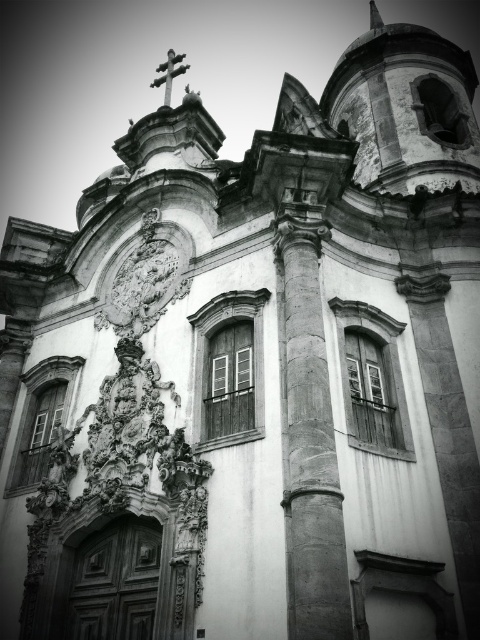
You are an architect analyzing the building facade. Which object, the smooth stone column at center or the metallic cross at upper center, is positioned closer to the observer?

The smooth stone column at center is closer to the viewer than the metallic cross at upper center.

You are an architect planning to install a new light fixture between the smooth stone column at center and the matte white clock at center. The light fixture requires a minimum of 3 meters of space between the two objects to be safely installed. Based on the scene description, is there enough space for the installation?

The smooth stone column at center and matte white clock at center are 25.62 meters apart, which is more than the required 3 meters. Therefore, there is sufficient space to install the light fixture between them.

You are standing in front of a historic Baroque building and notice a point marked at coordinates (310, 436). Based on the scene description, which architectural feature does this point most likely correspond to?

The point at coordinates (310, 436) corresponds to the smooth stone column at center.